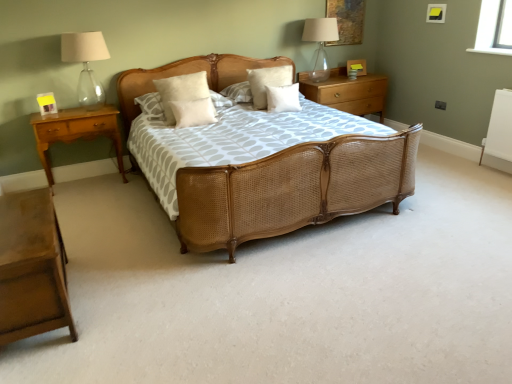
Question: Is light brown wood nightstand at left, the 1th nightstand viewed from the left, inside the boundaries of white matte pillow at center, which is the first pillow from right to left, or outside?

Choices:
 (A) inside
 (B) outside

Answer: (B)

Question: From the image's perspective, relative to white matte pillow at center, which is the first pillow from right to left, is light brown wood nightstand at left, which ranks as the 2th nightstand in bottom-to-top order, above or below?

Choices:
 (A) below
 (B) above

Answer: (A)

Question: Which of these objects is positioned closest to the white soft pillow at center, the second pillow when ordered from left to right?

Choices:
 (A) light brown wood nightstand at left, which is the 2th nightstand from front to back
 (B) white soft pillow at center, the fourth pillow positioned from the right
 (C) white fluffy pillow at center, positioned as the 2th pillow in right-to-left order
 (D) transparent glass table lamp at upper right, which is the 2th table lamp from front to back
 (E) light brown wood nightstand at lower left, acting as the second nightstand starting from the right

Answer: (B)

Question: Which object is positioned farthest from the light brown wood nightstand at lower left, placed as the third nightstand when sorted from top to bottom?

Choices:
 (A) white soft pillow at center, the second pillow when ordered from left to right
 (B) white soft pillow at center, the fourth pillow positioned from the right
 (C) clear glass table lamp at upper left, arranged as the second table lamp when viewed from the right
 (D) white fluffy pillow at center, positioned as the 2th pillow in right-to-left order
 (E) white matte pillow at center, acting as the fourth pillow starting from the left

Answer: (D)